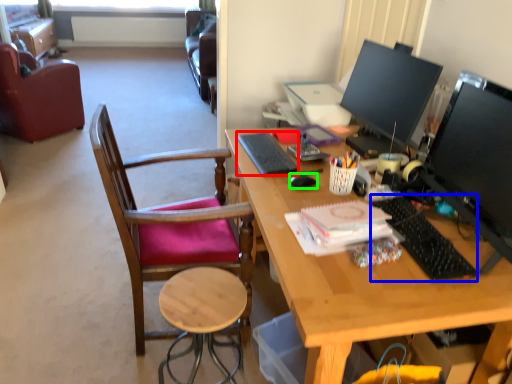
Question: Which object is positioned farthest from notepad (highlighted by a red box)? Select from keyboard (highlighted by a blue box) and mouse (highlighted by a green box).

Choices:
 (A) keyboard
 (B) mouse

Answer: (A)